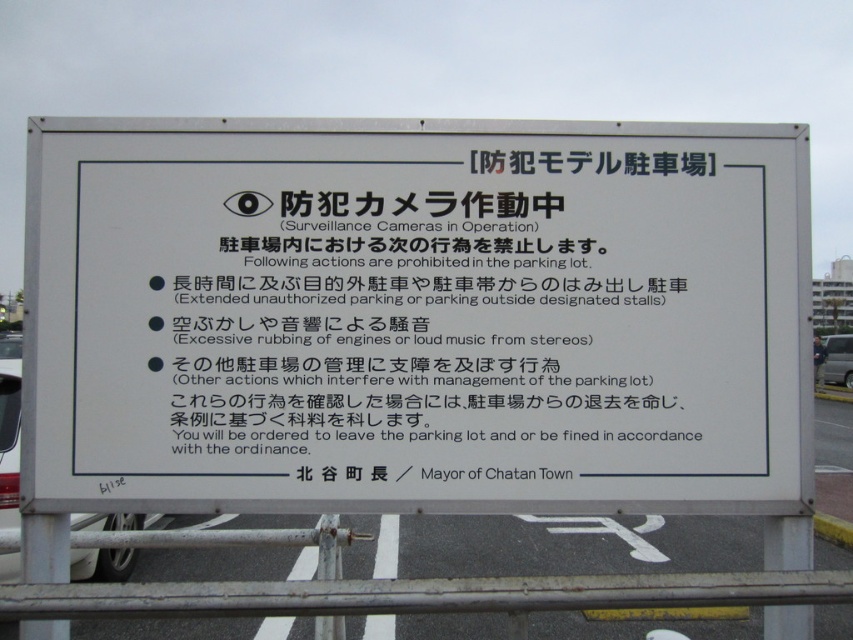
Question: Is white paper sign at center to the left of matte silver van at center-right from the viewer's perspective?

Choices:
 (A) yes
 (B) no

Answer: (A)

Question: Which of these objects is positioned farthest from the matte silver van at center-right?

Choices:
 (A) white paper sign at center
 (B) red matte car at lower left

Answer: (A)

Question: Which object appears closest to the camera in this image?

Choices:
 (A) matte silver van at center-right
 (B) red matte car at lower left

Answer: (B)

Question: Which object appears farthest from the camera in this image?

Choices:
 (A) red matte car at lower left
 (B) white paper sign at center
 (C) matte silver van at center-right

Answer: (C)

Question: Does red matte car at lower left appear over matte silver van at center-right?

Choices:
 (A) no
 (B) yes

Answer: (A)

Question: Is white paper sign at center in front of matte silver van at center-right?

Choices:
 (A) yes
 (B) no

Answer: (A)